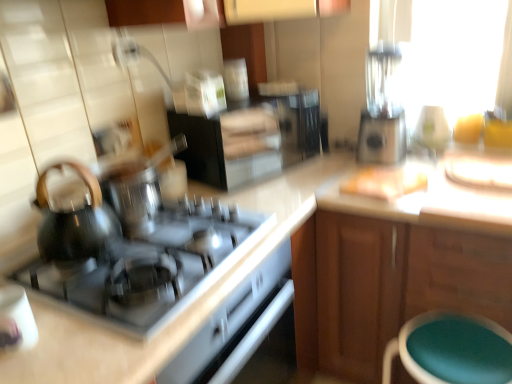
I want to click on free space in front of sleek silver blender at upper right, so (x=408, y=172).